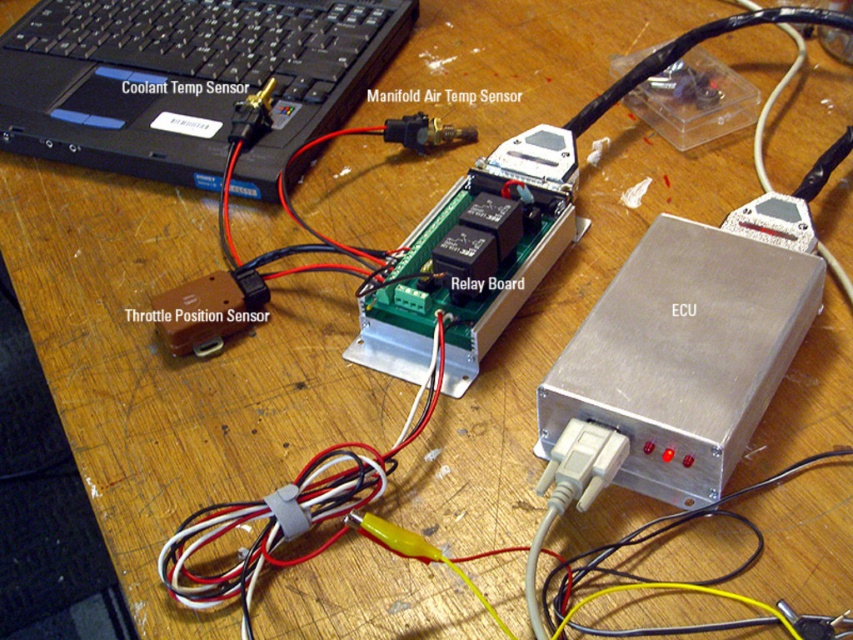
Question: Is black plastic laptop at upper left to the left of silver metallic ecu at center-right from the viewer's perspective?

Choices:
 (A) yes
 (B) no

Answer: (A)

Question: Is black plastic laptop at upper left thinner than silver metallic ecu at center-right?

Choices:
 (A) yes
 (B) no

Answer: (B)

Question: Does black plastic laptop at upper left have a smaller size compared to silver metallic ecu at center-right?

Choices:
 (A) yes
 (B) no

Answer: (B)

Question: Which object is farther from the camera taking this photo?

Choices:
 (A) black plastic laptop at upper left
 (B) silver metallic ecu at center-right

Answer: (A)

Question: Which object is closer to the camera taking this photo?

Choices:
 (A) black plastic laptop at upper left
 (B) silver metallic ecu at center-right

Answer: (B)